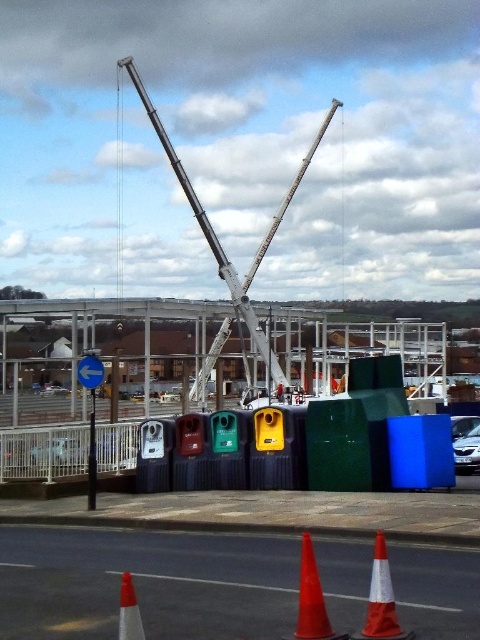
Question: Which point is farther to the camera?

Choices:
 (A) (204, 234)
 (B) (368, 637)
 (C) (312, 621)
 (D) (212, 516)

Answer: (A)

Question: Can you confirm if matte plastic recycling bins at center is bigger than orange matte traffic cone at lower center?

Choices:
 (A) no
 (B) yes

Answer: (B)

Question: Considering the real-world distances, which object is farthest from the orange reflective cone at lower left?

Choices:
 (A) orange matte traffic cone at lower center
 (B) matte plastic recycling bins at center

Answer: (B)

Question: Does orange matte traffic cone at lower center appear under orange reflective cone at lower left?

Choices:
 (A) yes
 (B) no

Answer: (A)

Question: Is white metallic crane at center below orange matte traffic cone at lower center?

Choices:
 (A) yes
 (B) no

Answer: (B)

Question: Which point is closer to the camera?

Choices:
 (A) (301, 604)
 (B) (384, 600)
 (C) (418, 330)

Answer: (B)